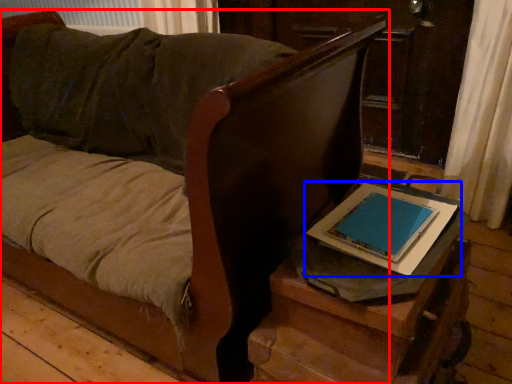
Question: Which of the following is the closest to the observer, furniture (highlighted by a red box) or tablet computer (highlighted by a blue box)?

Choices:
 (A) furniture
 (B) tablet computer

Answer: (A)